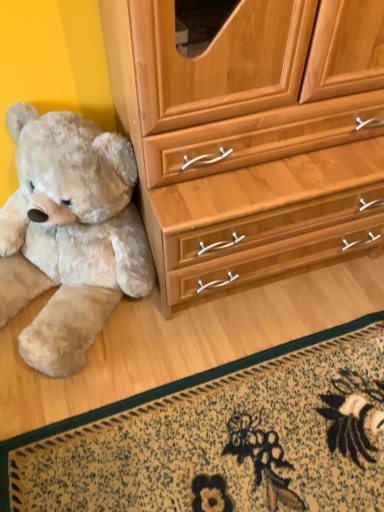
In order to click on free space in front of fluffy beige teddy bear at left in this screenshot , I will do `click(107, 440)`.